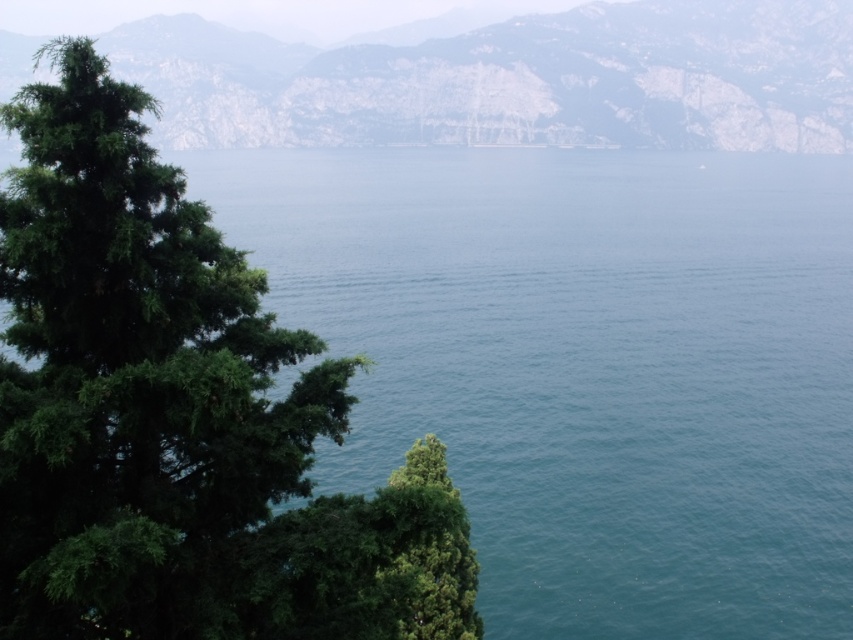
Question: Which of the following is the closest to the observer?

Choices:
 (A) green leafy tree at left
 (B) green textured mountain at upper center

Answer: (A)

Question: Which point is closer to the camera?

Choices:
 (A) (318, 582)
 (B) (648, 104)

Answer: (A)

Question: Does green leafy tree at left have a greater width compared to green textured mountain at upper center?

Choices:
 (A) no
 (B) yes

Answer: (A)

Question: Can you confirm if green leafy tree at left is smaller than green textured mountain at upper center?

Choices:
 (A) yes
 (B) no

Answer: (A)

Question: Is green leafy tree at left smaller than green textured mountain at upper center?

Choices:
 (A) no
 (B) yes

Answer: (B)